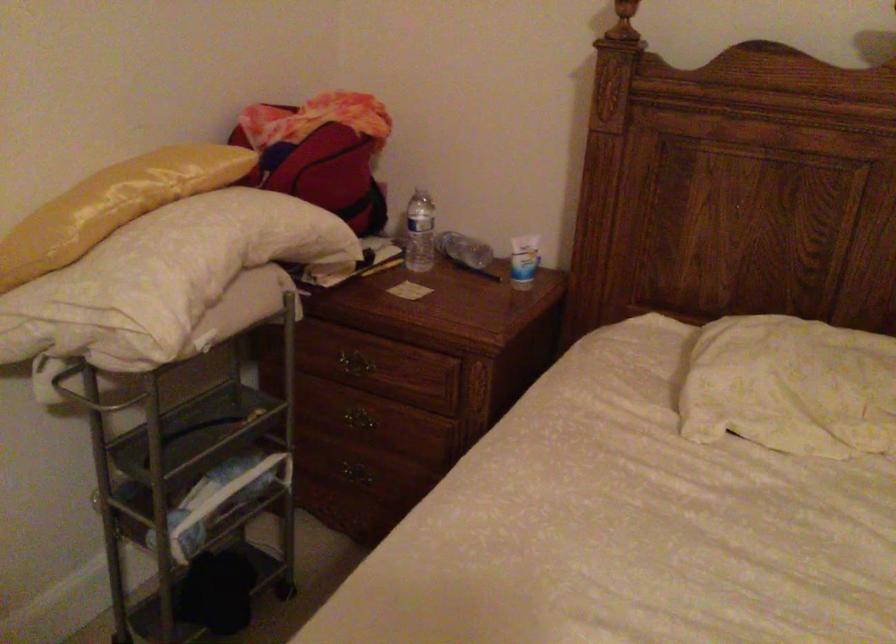
This screenshot has width=896, height=644. Find the location of `metal cart handle`. metal cart handle is located at coordinates (91, 393).